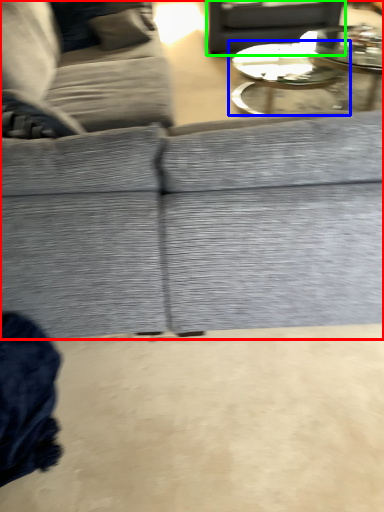
Question: Which is nearer to the studio couch (highlighted by a red box)? coffee table (highlighted by a blue box) or gray (highlighted by a green box).

Choices:
 (A) coffee table
 (B) gray

Answer: (A)